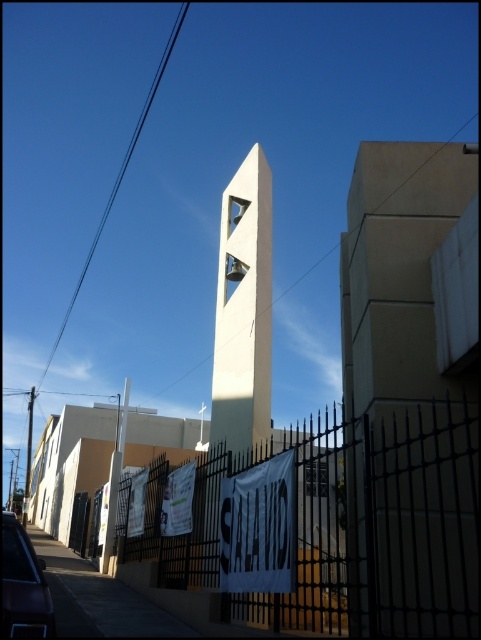
You are a visitor approaching the church and notice the black wrought iron fence at lower center and the black wire at upper left. Which object is taller?

The black wire at upper left is taller than the black wrought iron fence at lower center.

You are a visitor standing in front of the church. You notice the white smooth bell tower at center and the black wire at upper left. Which object is wider?

The black wire at upper left is wider than the white smooth bell tower at center.

Looking at this image, you are standing in front of the church and want to take a photo of the black wrought iron fence at lower center and the black wire at upper left. Which object will appear larger in your photo?

The black wrought iron fence at lower center will appear larger in the photo because it is closer to the viewer than the black wire at upper left.